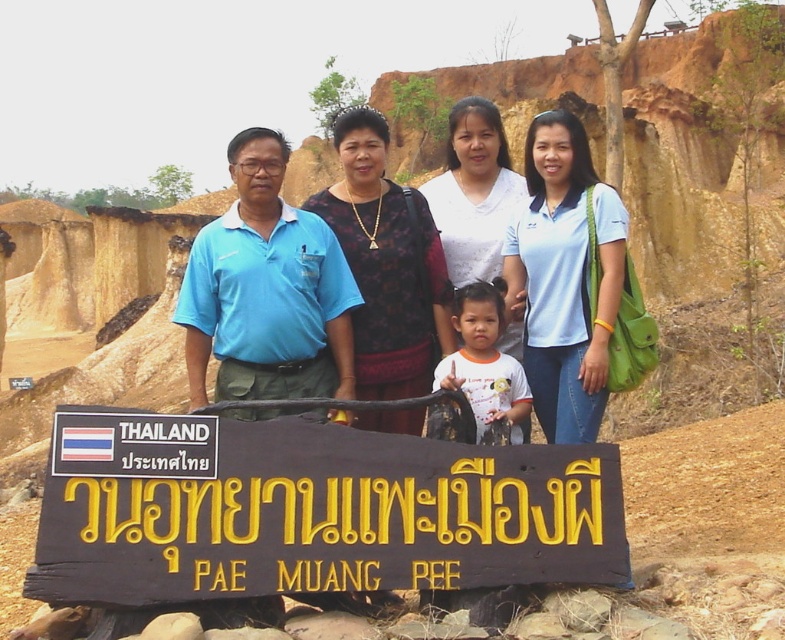
You are standing in front of the signboard and see two people wearing shirts at center. The first is a matte blue shirt at center and the second is a white matte shirt at center. Which shirt is positioned to the left?

The matte blue shirt at center is to the left of the white matte shirt at center.

You are standing at the camera position and want to read the text on the black wood sign at lower center. The sign is 26.70 meters away from you. Do you think you can read the text clearly without moving closer?

The black wood sign at lower center is 26.70 meters away from the camera. At that distance, it is unlikely you can read the text clearly without moving closer.

You are a photographer trying to capture a photo of the black wood sign at lower center and the matte blue shirt at center. Based on their positions, which object is closer to the camera?

The matte blue shirt at center is closer to the camera than the black wood sign at lower center because the black wood sign at lower center is positioned below it.